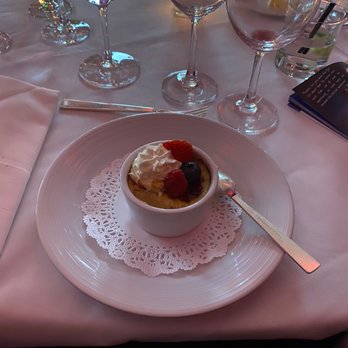
The height and width of the screenshot is (348, 348). I want to click on napkin, so click(19, 120).